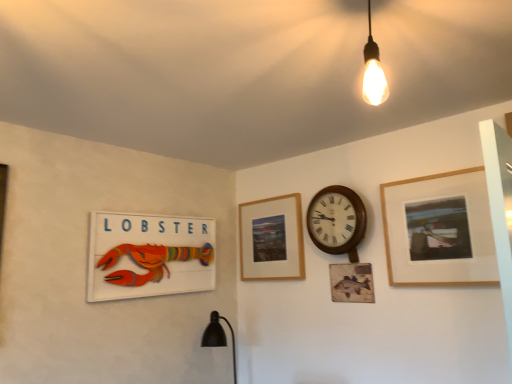
In order to click on wooden frame at upper right, the first picture frame positioned from the right in this screenshot , I will do `click(439, 230)`.

Describe the element at coordinates (439, 230) in the screenshot. I see `wooden frame at upper right, the first picture frame positioned from the right` at that location.

How much space does wooden picture frame at center, which ranks as the 2th picture frame in left-to-right order, occupy horizontally?

It is 1.74 inches.

Find the location of a particular element. The height and width of the screenshot is (384, 512). wooden lobster sign at left, marked as the first picture frame in a left-to-right arrangement is located at coordinates (149, 255).

Is wooden clock at center-right far away from wooden picture frame at center, which ranks as the 2th picture frame in left-to-right order?

Actually, wooden clock at center-right and wooden picture frame at center, which ranks as the 2th picture frame in left-to-right order, are a little close together.

Is wooden clock at center-right oriented towards wooden picture frame at center, which ranks as the 2th picture frame in left-to-right order?

No, wooden clock at center-right is not facing towards wooden picture frame at center, which ranks as the 2th picture frame in left-to-right order.

Between wooden clock at center-right and wooden picture frame at center, which ranks as the 2th picture frame in left-to-right order, which one has smaller width?

wooden picture frame at center, which ranks as the 2th picture frame in left-to-right order.

From a real-world perspective, is wooden lobster sign at left, positioned as the 3th picture frame in right-to-left order, physically located above or below wooden picture frame at center, which is the second picture frame in right-to-left order?

In terms of real-world spatial position, wooden lobster sign at left, positioned as the 3th picture frame in right-to-left order, is below wooden picture frame at center, which is the second picture frame in right-to-left order.

Considering the relative positions of wooden lobster sign at left, positioned as the 3th picture frame in right-to-left order, and wooden picture frame at center, which is the second picture frame in right-to-left order, in the image provided, is wooden lobster sign at left, positioned as the 3th picture frame in right-to-left order, behind wooden picture frame at center, which is the second picture frame in right-to-left order,?

No.

Does wooden lobster sign at left, positioned as the 3th picture frame in right-to-left order, have a larger size compared to wooden picture frame at center, which is the second picture frame in right-to-left order?

Indeed, wooden lobster sign at left, positioned as the 3th picture frame in right-to-left order, has a larger size compared to wooden picture frame at center, which is the second picture frame in right-to-left order.

Are wooden frame at upper right, marked as the third picture frame in a left-to-right arrangement, and wooden picture frame at center, which ranks as the 2th picture frame in left-to-right order, located far from each other?

Actually, wooden frame at upper right, marked as the third picture frame in a left-to-right arrangement, and wooden picture frame at center, which ranks as the 2th picture frame in left-to-right order, are a little close together.

From the image's perspective, would you say wooden frame at upper right, the first picture frame positioned from the right, is shown under wooden picture frame at center, which is the second picture frame in right-to-left order?

No, from the image's perspective, wooden frame at upper right, the first picture frame positioned from the right, is not below wooden picture frame at center, which is the second picture frame in right-to-left order.

Where is `the 2nd picture frame behind the wooden frame at upper right, the first picture frame positioned from the right, starting your count from the anchor`? The height and width of the screenshot is (384, 512). the 2nd picture frame behind the wooden frame at upper right, the first picture frame positioned from the right, starting your count from the anchor is located at coordinates pos(272,239).

Is wooden picture frame at center, which ranks as the 2th picture frame in left-to-right order, a part of wooden frame at upper right, the first picture frame positioned from the right?

No, wooden picture frame at center, which ranks as the 2th picture frame in left-to-right order, is not a part of wooden frame at upper right, the first picture frame positioned from the right.

Is wooden picture frame at center, which is the second picture frame in right-to-left order, beside wooden frame at upper right, marked as the third picture frame in a left-to-right arrangement?

wooden picture frame at center, which is the second picture frame in right-to-left order, and wooden frame at upper right, marked as the third picture frame in a left-to-right arrangement, are not in contact.

Can you confirm if wooden picture frame at center, which is the second picture frame in right-to-left order, is thinner than wooden frame at upper right, marked as the third picture frame in a left-to-right arrangement?

In fact, wooden picture frame at center, which is the second picture frame in right-to-left order, might be wider than wooden frame at upper right, marked as the third picture frame in a left-to-right arrangement.

Who is more distant, wooden picture frame at center, which ranks as the 2th picture frame in left-to-right order, or wooden frame at upper right, the first picture frame positioned from the right?

wooden picture frame at center, which ranks as the 2th picture frame in left-to-right order, is further away from the camera.

Is point (290, 256) less distant than point (362, 232)?

That is False.

How many degrees apart are the facing directions of wooden picture frame at center, which ranks as the 2th picture frame in left-to-right order, and wooden clock at center-right?

The angle between the facing direction of wooden picture frame at center, which ranks as the 2th picture frame in left-to-right order, and the facing direction of wooden clock at center-right is 0.741 degrees.

Find the location of a particular element. wall clock above the wooden picture frame at center, which is the second picture frame in right-to-left order (from the image's perspective) is located at coordinates (337, 221).

From the image's perspective, is wooden picture frame at center, which is the second picture frame in right-to-left order, located above or below wooden clock at center-right?

wooden picture frame at center, which is the second picture frame in right-to-left order, is below wooden clock at center-right.

Is wooden clock at center-right located outside wooden frame at upper right, marked as the third picture frame in a left-to-right arrangement?

Yes, wooden clock at center-right is not within wooden frame at upper right, marked as the third picture frame in a left-to-right arrangement.

Considering their positions, is wooden clock at center-right located in front of or behind wooden frame at upper right, marked as the third picture frame in a left-to-right arrangement?

Visually, wooden clock at center-right is located behind wooden frame at upper right, marked as the third picture frame in a left-to-right arrangement.

You are a GUI agent. You are given a task and a screenshot of the screen. Output one action in this format:
    pyautogui.click(x=<x>, y=<y>)
    Task: Click on the 2nd picture frame in front of the wooden clock at center-right, counting from the anchor's position
    This screenshot has height=384, width=512.
    Given the screenshot: What is the action you would take?
    pyautogui.click(x=439, y=230)

From the image's perspective, between wooden clock at center-right and wooden frame at upper right, marked as the third picture frame in a left-to-right arrangement, who is located below?

wooden frame at upper right, marked as the third picture frame in a left-to-right arrangement, appears lower in the image.

Would you say wooden clock at center-right contains wooden lobster sign at left, positioned as the 3th picture frame in right-to-left order?

No, wooden lobster sign at left, positioned as the 3th picture frame in right-to-left order, is not surrounded by wooden clock at center-right.

What's the angular difference between wooden clock at center-right and wooden lobster sign at left, marked as the first picture frame in a left-to-right arrangement,'s facing directions?

The angle between the facing direction of wooden clock at center-right and the facing direction of wooden lobster sign at left, marked as the first picture frame in a left-to-right arrangement, is 88.4 degrees.

Considering the relative positions of wooden clock at center-right and wooden lobster sign at left, positioned as the 3th picture frame in right-to-left order, in the image provided, is wooden clock at center-right to the left of wooden lobster sign at left, positioned as the 3th picture frame in right-to-left order, from the viewer's perspective?

In fact, wooden clock at center-right is to the right of wooden lobster sign at left, positioned as the 3th picture frame in right-to-left order.

Considering the sizes of objects wooden clock at center-right and wooden lobster sign at left, positioned as the 3th picture frame in right-to-left order, in the image provided, who is smaller, wooden clock at center-right or wooden lobster sign at left, positioned as the 3th picture frame in right-to-left order,?

With smaller size is wooden lobster sign at left, positioned as the 3th picture frame in right-to-left order.

Where is `wall clock to the right of wooden picture frame at center, which is the second picture frame in right-to-left order`? The image size is (512, 384). wall clock to the right of wooden picture frame at center, which is the second picture frame in right-to-left order is located at coordinates (337, 221).

I want to click on picture frame that appears below the wooden picture frame at center, which is the second picture frame in right-to-left order (from the image's perspective), so click(149, 255).

Based on their spatial positions, is wooden frame at upper right, marked as the third picture frame in a left-to-right arrangement, or wooden clock at center-right closer to wooden lobster sign at left, marked as the first picture frame in a left-to-right arrangement?

Based on the image, wooden clock at center-right appears to be nearer to wooden lobster sign at left, marked as the first picture frame in a left-to-right arrangement.

Based on their spatial positions, is wooden clock at center-right or wooden lobster sign at left, marked as the first picture frame in a left-to-right arrangement, further from wooden picture frame at center, which is the second picture frame in right-to-left order?

Among the two, wooden lobster sign at left, marked as the first picture frame in a left-to-right arrangement, is located further to wooden picture frame at center, which is the second picture frame in right-to-left order.

From the image, which object appears to be farther from wooden clock at center-right, wooden frame at upper right, marked as the third picture frame in a left-to-right arrangement, or wooden picture frame at center, which ranks as the 2th picture frame in left-to-right order?

wooden picture frame at center, which ranks as the 2th picture frame in left-to-right order.

Considering their positions, is wooden frame at upper right, marked as the third picture frame in a left-to-right arrangement, positioned closer to wooden picture frame at center, which ranks as the 2th picture frame in left-to-right order, than wooden clock at center-right?

wooden clock at center-right is closer to wooden picture frame at center, which ranks as the 2th picture frame in left-to-right order.

From the image, which object appears to be farther from wooden picture frame at center, which ranks as the 2th picture frame in left-to-right order, wooden lobster sign at left, marked as the first picture frame in a left-to-right arrangement, or wooden frame at upper right, marked as the third picture frame in a left-to-right arrangement?

wooden frame at upper right, marked as the third picture frame in a left-to-right arrangement, is further to wooden picture frame at center, which ranks as the 2th picture frame in left-to-right order.

Based on their spatial positions, is wooden frame at upper right, marked as the third picture frame in a left-to-right arrangement, or wooden lobster sign at left, marked as the first picture frame in a left-to-right arrangement, further from wooden clock at center-right?

wooden lobster sign at left, marked as the first picture frame in a left-to-right arrangement, lies further to wooden clock at center-right than the other object.

When comparing their distances from wooden clock at center-right, does wooden lobster sign at left, positioned as the 3th picture frame in right-to-left order, or wooden frame at upper right, the first picture frame positioned from the right, seem closer?

wooden frame at upper right, the first picture frame positioned from the right.

Estimate the real-world distances between objects in this image. Which object is closer to wooden frame at upper right, the first picture frame positioned from the right, wooden clock at center-right or wooden picture frame at center, which is the second picture frame in right-to-left order?

wooden clock at center-right.

This screenshot has width=512, height=384. Identify the location of picture frame situated between wooden lobster sign at left, marked as the first picture frame in a left-to-right arrangement, and wooden clock at center-right from left to right. [272, 239].

This screenshot has width=512, height=384. Find the location of `wall clock between wooden picture frame at center, which is the second picture frame in right-to-left order, and wooden frame at upper right, marked as the third picture frame in a left-to-right arrangement, in the horizontal direction`. wall clock between wooden picture frame at center, which is the second picture frame in right-to-left order, and wooden frame at upper right, marked as the third picture frame in a left-to-right arrangement, in the horizontal direction is located at coordinates (337, 221).

What are the coordinates of `picture frame between wooden lobster sign at left, positioned as the 3th picture frame in right-to-left order, and wooden frame at upper right, the first picture frame positioned from the right, in the horizontal direction` in the screenshot? It's located at (272, 239).

Locate an element on the screen. This screenshot has height=384, width=512. wall clock between wooden lobster sign at left, positioned as the 3th picture frame in right-to-left order, and wooden frame at upper right, the first picture frame positioned from the right is located at coordinates (337, 221).